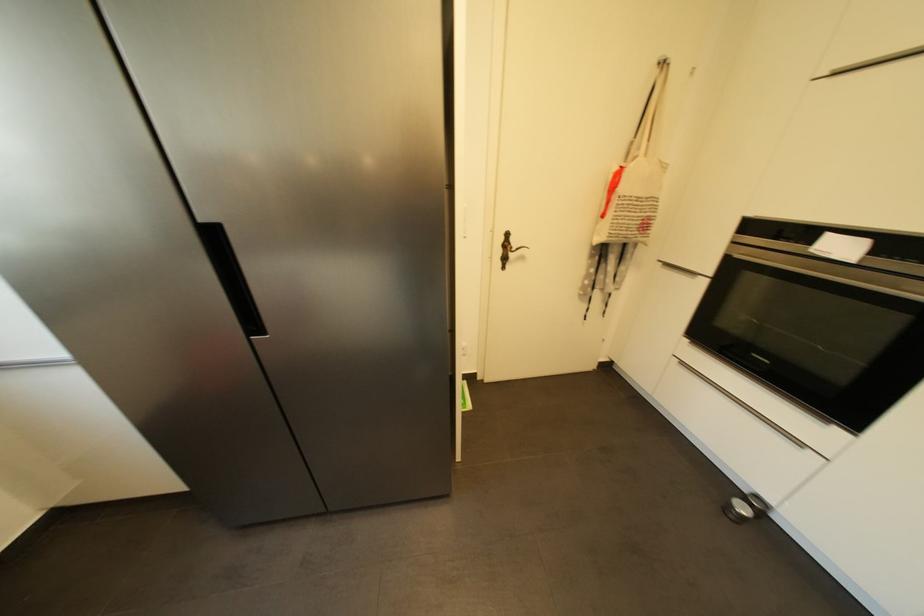
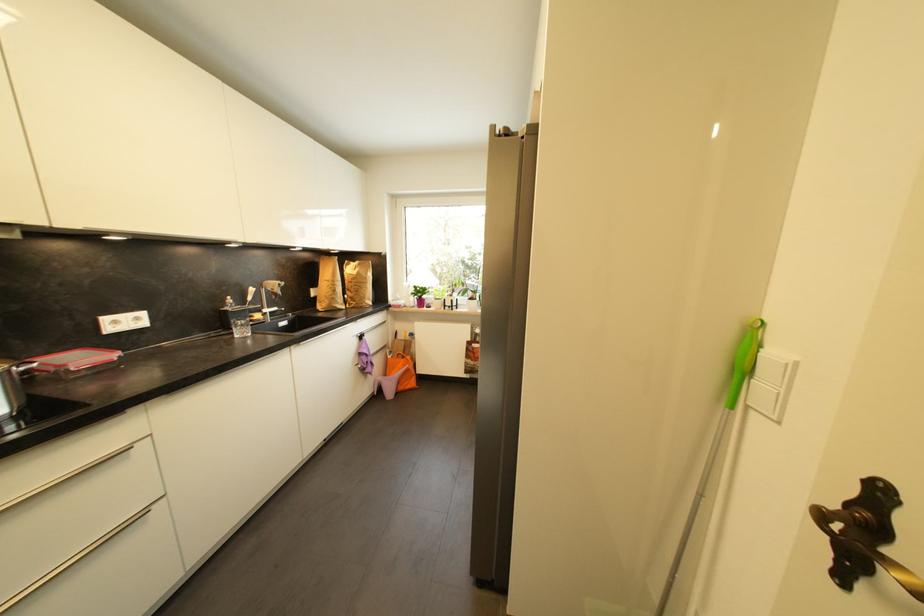
Question: I am providing you with two images of the same scene from different viewpoints. Which of the following objects are not visible in image2?

Choices:
 (A) orange shopping bag
 (B) red lidded container
 (C) silver drawer handle
 (D) none of these

Answer: (D)